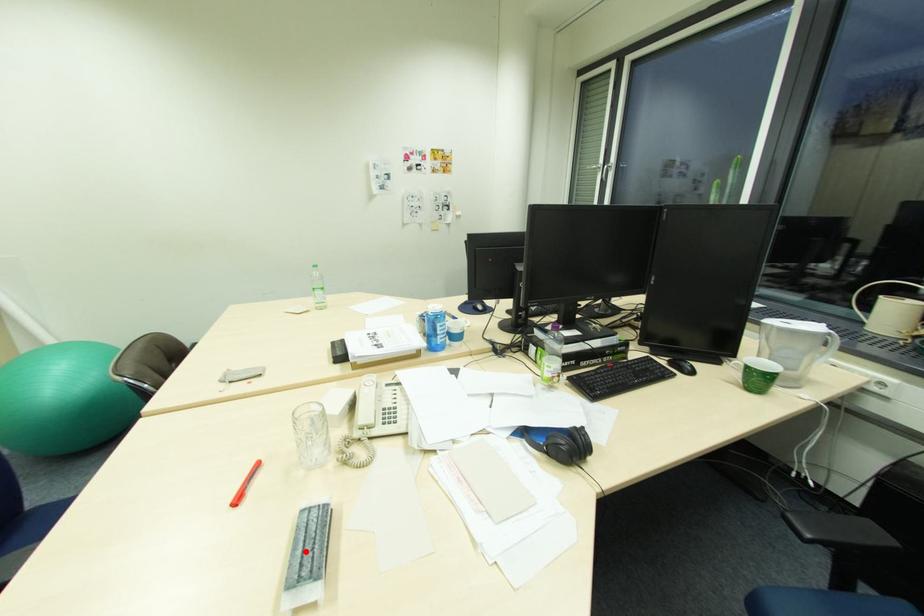
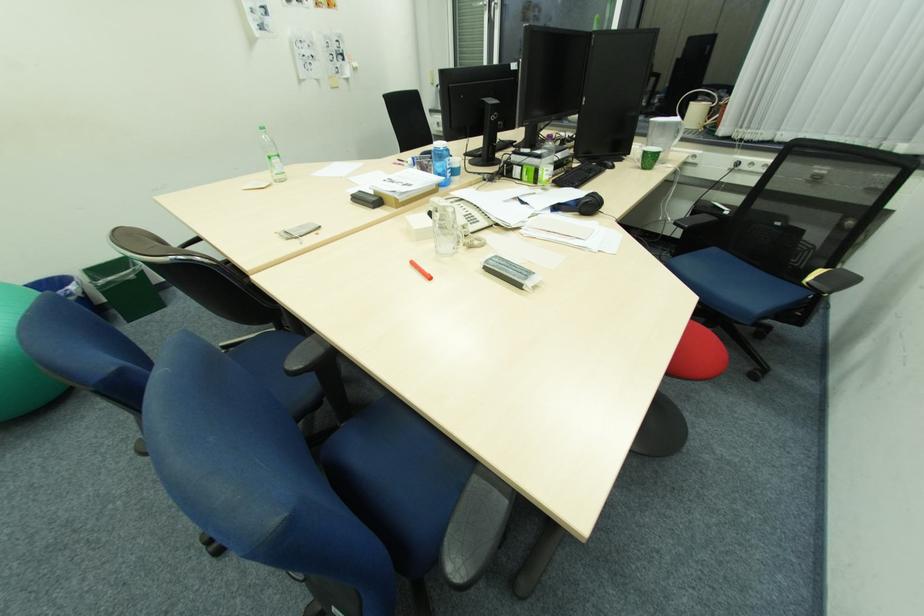
Locate, in the second image, the point that corresponds to the highlighted location in the first image.

(517, 270)